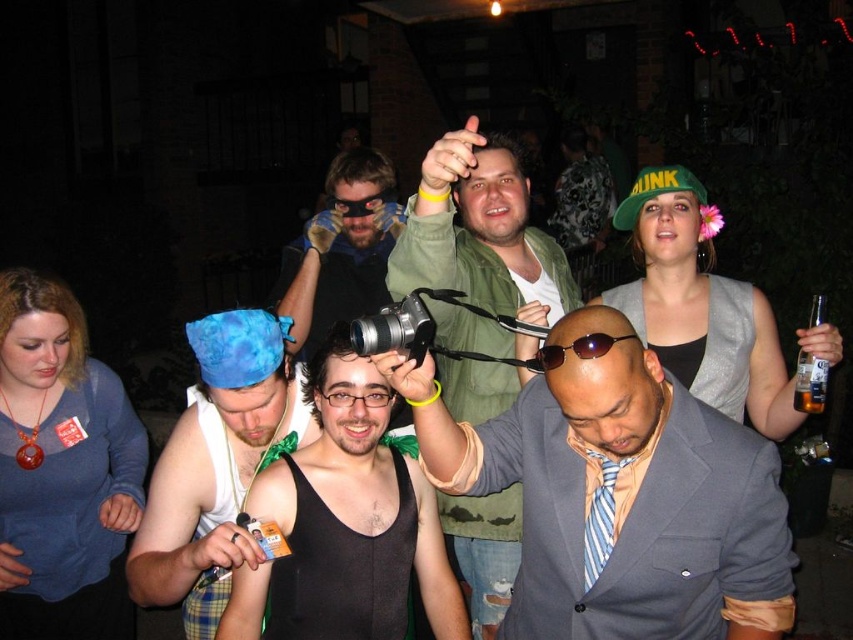
Question: Can you confirm if gray suit at center is bigger than striped silk tie at center?

Choices:
 (A) no
 (B) yes

Answer: (B)

Question: Which object appears closest to the camera in this image?

Choices:
 (A) blue fabric hat at left
 (B) black matte tank top at center

Answer: (A)

Question: Can you confirm if clear glass bottle at right is positioned to the left of black rubber goggles at center?

Choices:
 (A) no
 (B) yes

Answer: (A)

Question: Which object is the closest to the blue fabric hat at left?

Choices:
 (A) matte black camera at center
 (B) black rubber goggles at center
 (C) striped silk tie at center
 (D) clear glass bottle at right

Answer: (A)

Question: Among these points, which one is nearest to the camera?

Choices:
 (A) (393, 397)
 (B) (477, 499)
 (C) (579, 349)

Answer: (C)

Question: Is blue fabric hat at left wider than black matte tank top at center?

Choices:
 (A) no
 (B) yes

Answer: (B)